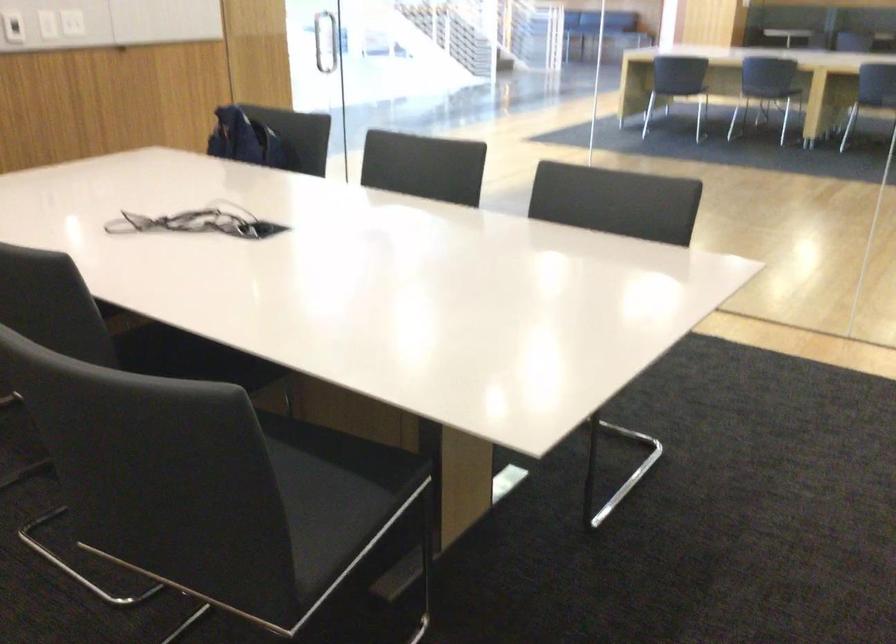
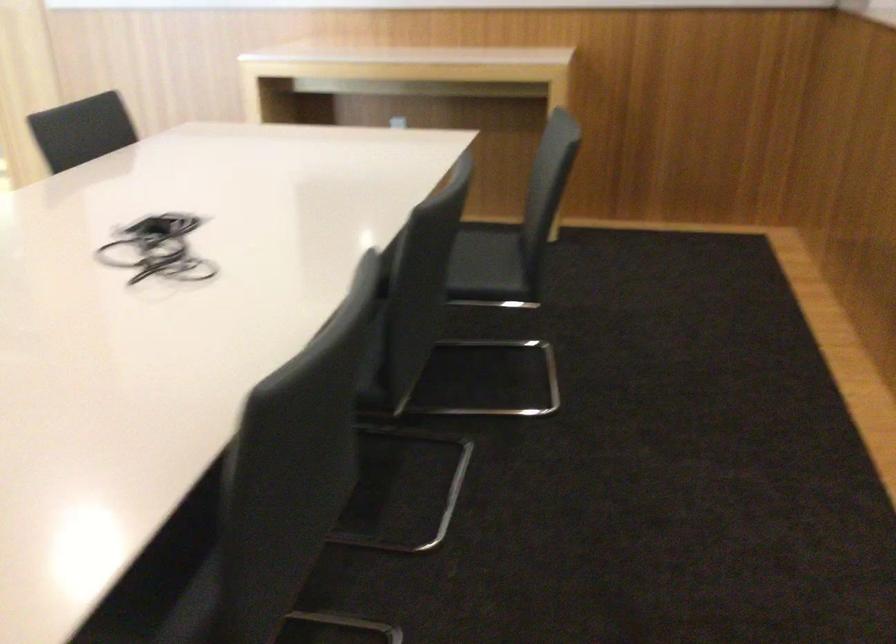
Find the pixel in the second image that matches point (227, 527) in the first image.

(490, 266)